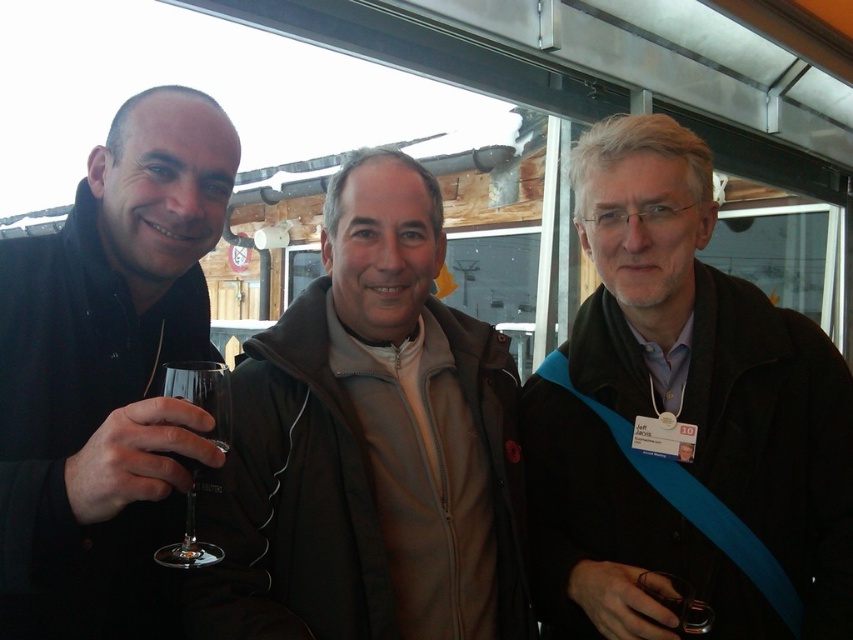
You are at a social event and want to take a photo of two specific points in the image. The first point is at coordinates point (538, 472) and the second point is at point (242, 428). Which point is closer to you when you take the photo?

Point (538, 472) is closer to you than point (242, 428) because it is further to the viewer in the image.

You are a photographer at this event and want to take a photo of the matte black jacket at right without the transparent glass at left appearing in the frame. Is this possible based on their positions?

The transparent glass at left is behind the matte black jacket at right, so it won not appear in the frame if you position the camera to focus solely on the matte black jacket at right.